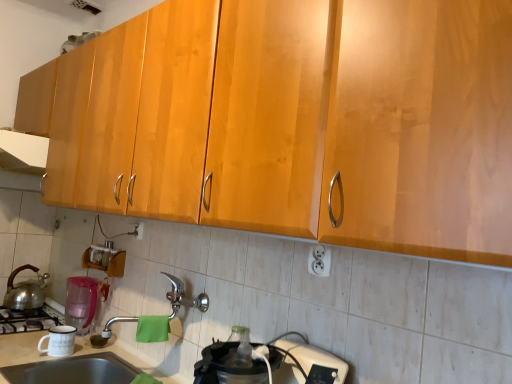
Question: From a real-world perspective, is silver metallic faucet at center above or below matte stainless steel sink at lower left?

Choices:
 (A) above
 (B) below

Answer: (A)

Question: Is silver metallic faucet at center wider or thinner than matte stainless steel sink at lower left?

Choices:
 (A) thin
 (B) wide

Answer: (A)

Question: Based on their relative distances, which object is nearer to the pink plastic pitcher at lower left, acting as the 1th appliance starting from the back?

Choices:
 (A) white plastic electric outlet at center, marked as the 2th electric outlet in a right-to-left arrangement
 (B) matte stainless steel sink at lower left
 (C) white plastic outlet at lower center, acting as the 2th electric outlet starting from the left
 (D) silver metallic faucet at center
 (E) white ceramic mug at lower left, placed as the 2th appliance when sorted from back to front

Answer: (E)

Question: Which object is the farthest from the pink plastic pitcher at lower left, the second appliance positioned from the front?

Choices:
 (A) shiny metallic tea pot at left
 (B) silver metallic faucet at center
 (C) white glossy exhaust hood at upper left
 (D) white ceramic mug at lower left, which is counted as the first appliance, starting from the front
 (E) white plastic outlet at lower center, acting as the 1th electric outlet starting from the right

Answer: (E)